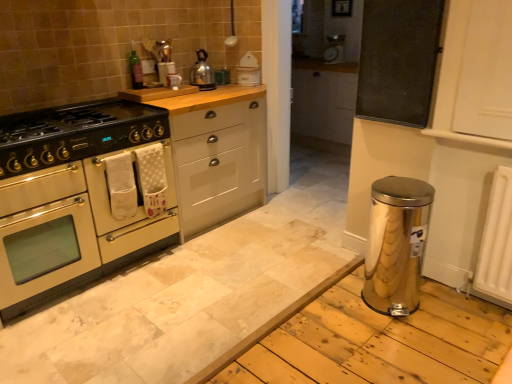
Question: From the image's perspective, is matte black gas stove at left above or below green glass bottle at upper center?

Choices:
 (A) below
 (B) above

Answer: (A)

Question: Would you say matte black gas stove at left is inside or outside green glass bottle at upper center?

Choices:
 (A) outside
 (B) inside

Answer: (A)

Question: Estimate the real-world distances between objects in this image. Which object is closer to the cream matte oven at left, the 2th cabinetry positioned from the right?

Choices:
 (A) white matte cabinet at center, the 2th cabinetry in the left-to-right sequence
 (B) stainless steel water heater at lower right
 (C) white plastic toaster at upper center
 (D) matte black gas stove at left
 (E) polished stainless steel kettle at upper center

Answer: (A)

Question: Which is farther from the polished stainless steel kettle at upper center?

Choices:
 (A) green glass bottle at upper center
 (B) metallic mesh board at upper right
 (C) white plastic toaster at upper center
 (D) stainless steel water heater at lower right
 (E) matte black gas stove at left

Answer: (D)